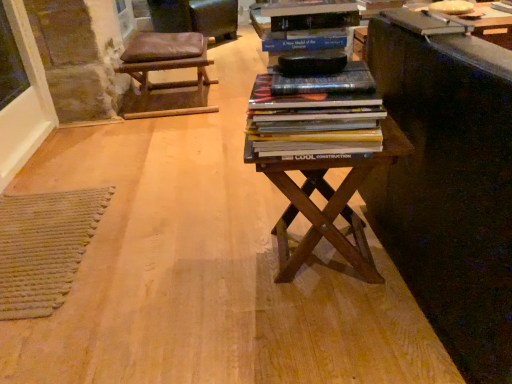
The height and width of the screenshot is (384, 512). In order to click on free point above hardcover book at upper right (from a real-world perspective) in this screenshot , I will do `click(421, 17)`.